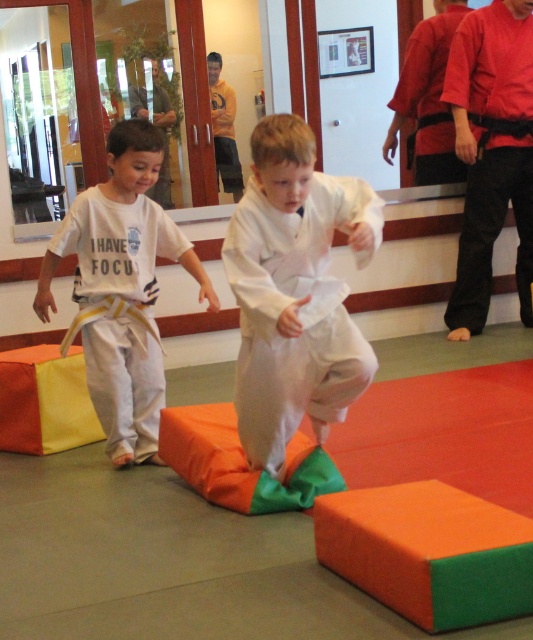
You are a martial arts instructor observing the children in the dojo. You need to determine which clothing item is narrower between the white cotton kimono at center and the yellow belt at left. Which one is it?

The white cotton kimono at center is thinner than the yellow belt at left, so the white cotton kimono at center is narrower.

What is located at the coordinates point (294, 291) in the image?

The point (294, 291) indicates the white cotton kimono at center.

You are a martial arts instructor observing the children in the dojo. You notice the white cotton kimono at center and the yellow belt at left. How far apart are these two items?

The white cotton kimono at center and the yellow belt at left are 35.84 inches apart.